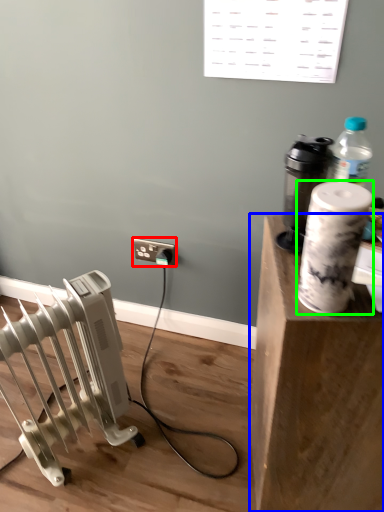
Question: Which is nearer to the electric outlet (highlighted by a red box)? furniture (highlighted by a blue box) or paper towel (highlighted by a green box).

Choices:
 (A) furniture
 (B) paper towel

Answer: (A)